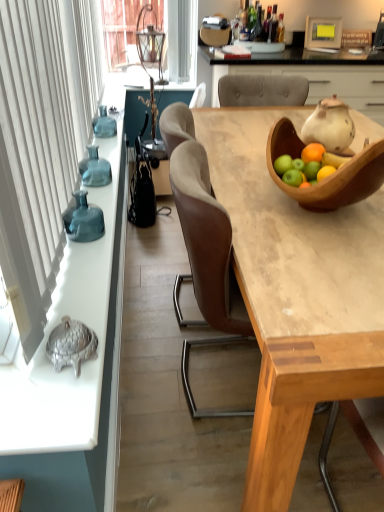
This screenshot has height=512, width=384. What are the coordinates of `unoccupied space behind teal glass vase at left, the 1th vase from the front` in the screenshot? It's located at (103, 210).